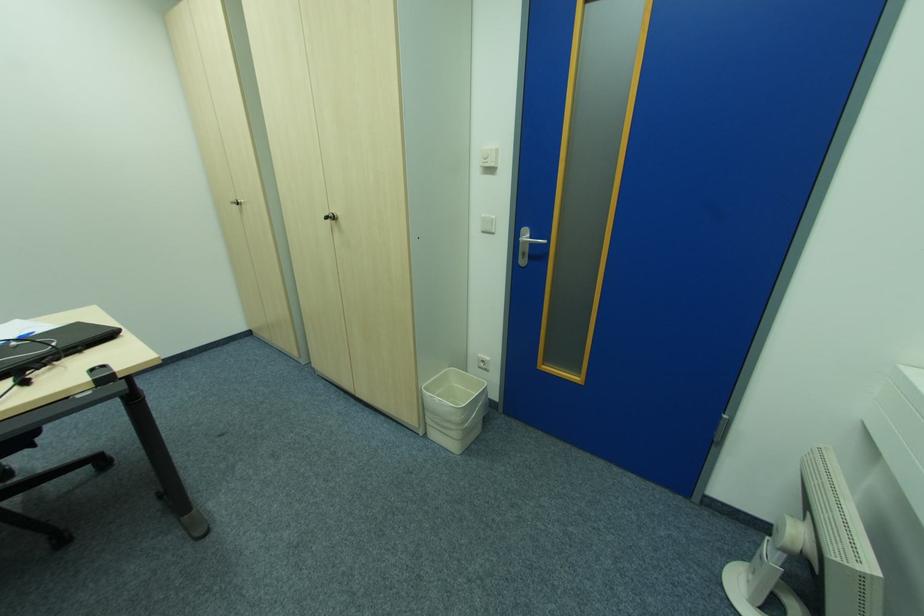
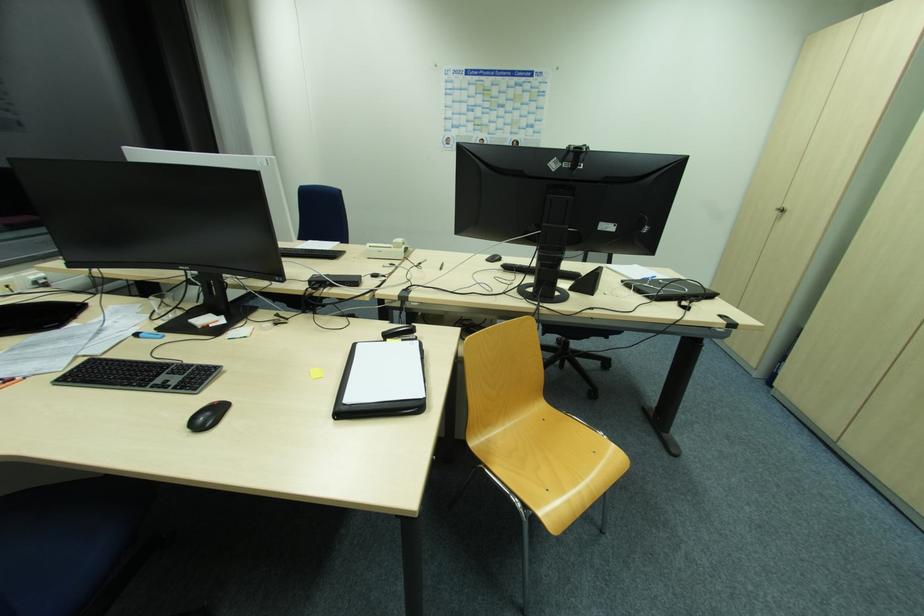
In the second image, find the point that corresponds to point 237,207 in the first image.

(779, 214)